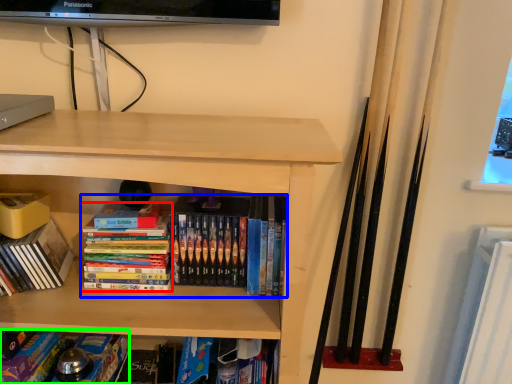
Question: Based on their relative distances, which object is farther from book (highlighted by a red box)? Choose from book (highlighted by a blue box) and book (highlighted by a green box).

Choices:
 (A) book
 (B) book

Answer: (B)